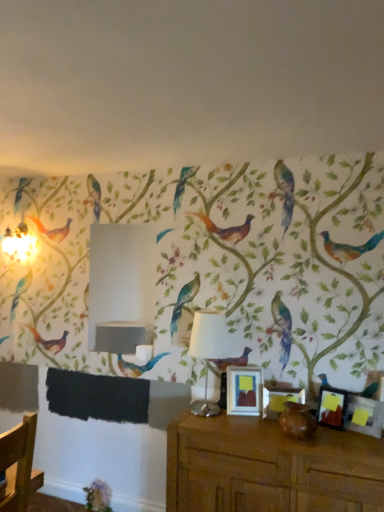
Find the location of a particular element. This screenshot has height=512, width=384. vacant area to the left of brown matte vase at lower center is located at coordinates (260, 429).